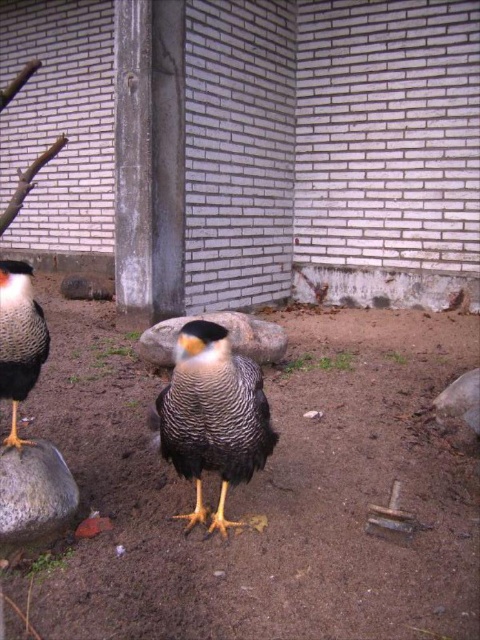
You are a small animal trying to move from the brown sandy soil at center to the gray smooth rock at center. The distance between them is crucial for your jump. Can you make the jump if your maximum jump distance is 22 inches?

The brown sandy soil at center is 23.17 inches from the gray smooth rock at center. Since your maximum jump distance is 22 inches, you cannot make the jump between them.

You are a zookeeper who needs to place a small feeding tray for the birds. The tray must be placed on the ground where both the brown sandy soil at center and the gray smooth rock at lower left are visible. Where should you place the tray?

The brown sandy soil at center is located above the gray smooth rock at lower left, so placing the feeding tray on the brown sandy soil at center would allow visibility of both the soil and the rock beneath it.

You are a zookeeper observing the birds in their enclosure. You notice the brown sandy soil at center and the gray smooth rock at center. Which object is nearer to you?

The brown sandy soil at center is closer to the viewer than the gray smooth rock at center, so the brown sandy soil at center is nearer.